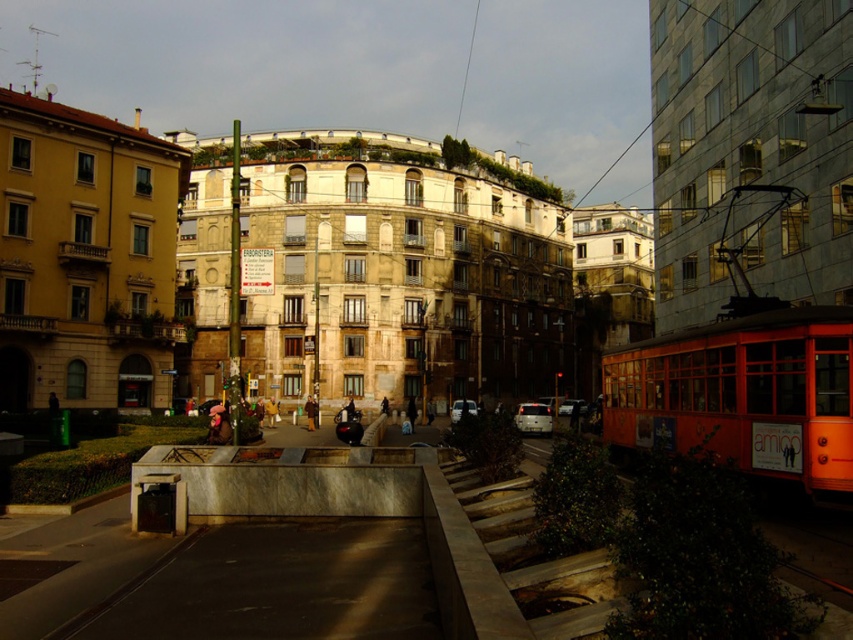
You are a delivery drone with a wingspan of 1.2 meters. You need to fly through the gap between the white glossy car at center and the silver metallic car at center. Can you safely pass through without touching either vehicle?

The gap between the white glossy car at center and the silver metallic car at center is 15.66 meters, which is significantly wider than the drone wingspan of 1.2 meters. Yes, the drone can safely pass through the gap without touching either vehicle.